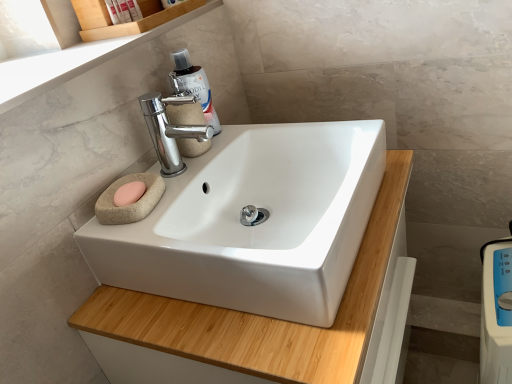
The image size is (512, 384). In order to click on vacant space to the right of matte plastic soap at upper left, which is the 1th toiletry in left-to-right order in this screenshot , I will do `click(168, 18)`.